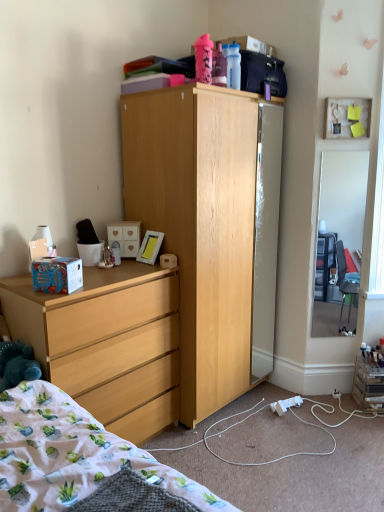
Question: Can we say fluffy cotton blanket at lower left lies outside white matte drawer at center?

Choices:
 (A) no
 (B) yes

Answer: (B)

Question: Is fluffy cotton blanket at lower left closer to the viewer compared to white matte drawer at center?

Choices:
 (A) no
 (B) yes

Answer: (B)

Question: Would you say fluffy cotton blanket at lower left contains white matte drawer at center?

Choices:
 (A) yes
 (B) no

Answer: (B)

Question: Does fluffy cotton blanket at lower left have a greater width compared to white matte drawer at center?

Choices:
 (A) yes
 (B) no

Answer: (A)

Question: From a real-world perspective, is fluffy cotton blanket at lower left below white matte drawer at center?

Choices:
 (A) no
 (B) yes

Answer: (B)

Question: Relative to blue cardboard box at left, is clear glass mirror at right in front or behind?

Choices:
 (A) behind
 (B) front

Answer: (A)

Question: In terms of height, does clear glass mirror at right look taller or shorter compared to blue cardboard box at left?

Choices:
 (A) short
 (B) tall

Answer: (B)

Question: Would you say clear glass mirror at right is to the left or to the right of blue cardboard box at left in the picture?

Choices:
 (A) right
 (B) left

Answer: (A)

Question: From the image's perspective, is clear glass mirror at right positioned above or below blue cardboard box at left?

Choices:
 (A) above
 (B) below

Answer: (A)

Question: In terms of size, does white matte drawer at center appear bigger or smaller than mirror glass refrigerator at center?

Choices:
 (A) small
 (B) big

Answer: (A)

Question: Looking at their shapes, would you say white matte drawer at center is wider or thinner than mirror glass refrigerator at center?

Choices:
 (A) thin
 (B) wide

Answer: (B)

Question: From a real-world perspective, is white matte drawer at center positioned above or below mirror glass refrigerator at center?

Choices:
 (A) below
 (B) above

Answer: (B)

Question: Is white matte drawer at center spatially inside mirror glass refrigerator at center, or outside of it?

Choices:
 (A) outside
 (B) inside

Answer: (A)

Question: Is mirror glass refrigerator at center spatially inside blue cardboard box at left, or outside of it?

Choices:
 (A) outside
 (B) inside

Answer: (A)

Question: From a real-world perspective, is mirror glass refrigerator at center positioned above or below blue cardboard box at left?

Choices:
 (A) above
 (B) below

Answer: (B)